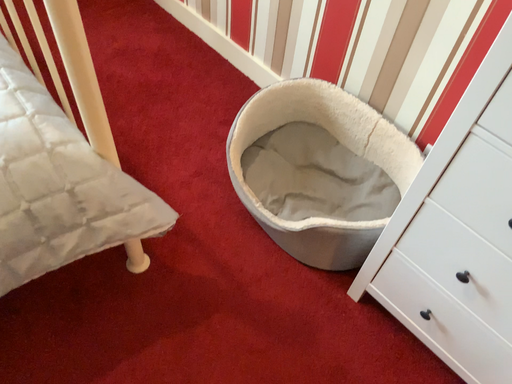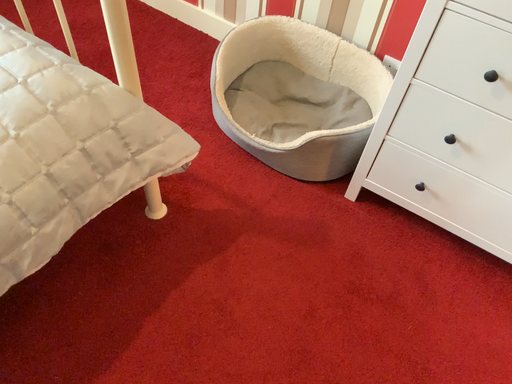
Question: How did the camera likely rotate when shooting the video?

Choices:
 (A) rotated right
 (B) rotated left

Answer: (A)